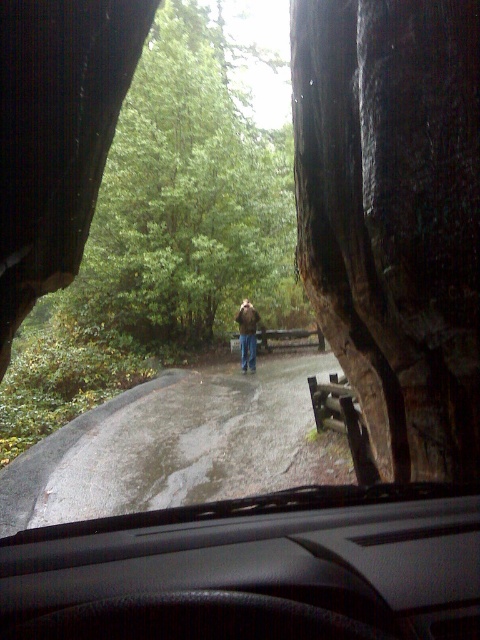
Question: Is green leafy tree at center positioned at the back of brown leather jacket at center?

Choices:
 (A) yes
 (B) no

Answer: (A)

Question: Which point is farther to the camera?

Choices:
 (A) brown leather jacket at center
 (B) green leafy tree at center

Answer: (B)

Question: Can you confirm if green leafy tree at center is thinner than brown leather jacket at center?

Choices:
 (A) yes
 (B) no

Answer: (B)

Question: Which of the following is the farthest from the observer?

Choices:
 (A) (252, 330)
 (B) (255, 131)

Answer: (B)

Question: Is green leafy tree at center bigger than brown leather jacket at center?

Choices:
 (A) yes
 (B) no

Answer: (A)